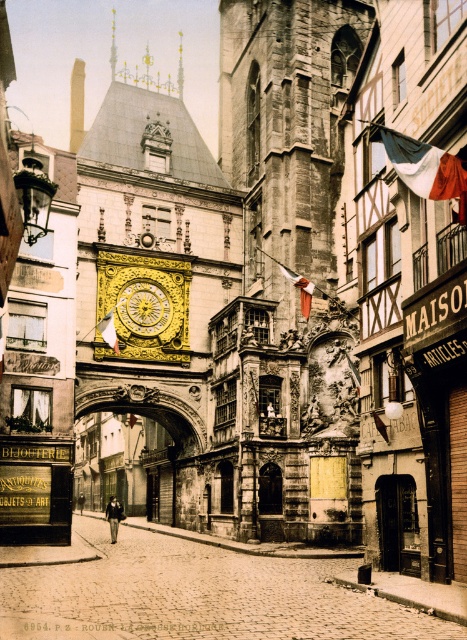
Question: Which is farther from the gold ornate archway at center?

Choices:
 (A) stone textured tower at center
 (B) gold polished clock at center
 (C) goldmetallicclock at center

Answer: (A)

Question: Which of the following is the farthest from the observer?

Choices:
 (A) goldmetallicclock at center
 (B) gold polished clock at center
 (C) stone textured tower at center

Answer: (B)

Question: Which of the following is the closest to the observer?

Choices:
 (A) stone textured tower at center
 (B) goldmetallicclock at center
 (C) gold ornate archway at center
 (D) gold polished clock at center

Answer: (A)

Question: Can you confirm if goldmetallicclock at center is positioned above gold polished clock at center?

Choices:
 (A) yes
 (B) no

Answer: (A)

Question: Can you confirm if stone textured tower at center is positioned below gold polished clock at center?

Choices:
 (A) no
 (B) yes

Answer: (A)

Question: Does gold ornate archway at center lie in front of goldmetallicclock at center?

Choices:
 (A) no
 (B) yes

Answer: (A)